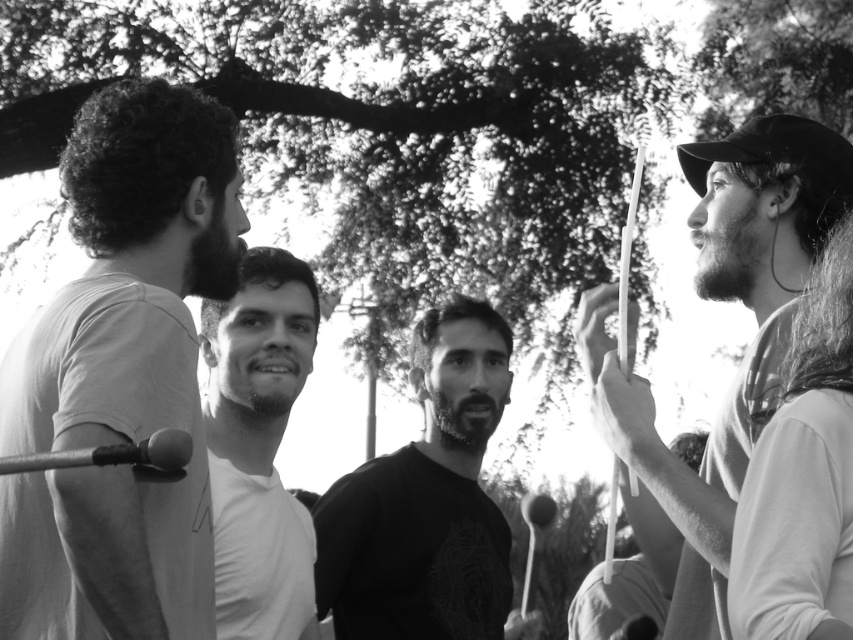
Between point (202, 282) and point (466, 589), which one is positioned in front?

Point (202, 282) is more forward.

Find the location of a particular element. Image resolution: width=853 pixels, height=640 pixels. white matte t-shirt at left is located at coordinates (120, 374).

Can you confirm if smooth white drumstick at right is positioned to the right of white plastic drumstick at right?

No, smooth white drumstick at right is not to the right of white plastic drumstick at right.

Who is more distant from viewer, [770,244] or [635,572]?

Positioned behind is point [635,572].

This screenshot has width=853, height=640. I want to click on smooth white drumstick at right, so click(749, 346).

In the scene shown: Is smooth white drumstick at right further to the viewer compared to smooth black shirt at center?

No, it is not.

Is smooth white drumstick at right above smooth black shirt at center?

Indeed, smooth white drumstick at right is positioned over smooth black shirt at center.

Who is more distant from viewer, (775,232) or (427,612)?

Point (427,612)

Locate an element on the screen. The width and height of the screenshot is (853, 640). smooth white drumstick at right is located at coordinates (749, 346).